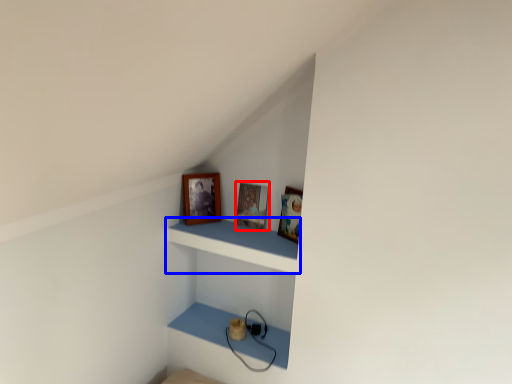
Question: Which object is closer to the camera taking this photo, picture frame (highlighted by a red box) or shelf (highlighted by a blue box)?

Choices:
 (A) picture frame
 (B) shelf

Answer: (B)